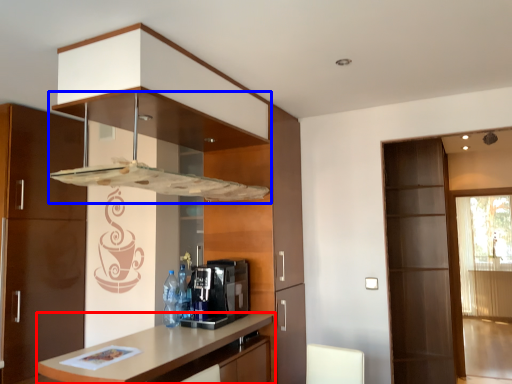
Question: Which of the following is the farthest to the observer, countertop (highlighted by a red box) or exhaust hood (highlighted by a blue box)?

Choices:
 (A) countertop
 (B) exhaust hood

Answer: (B)